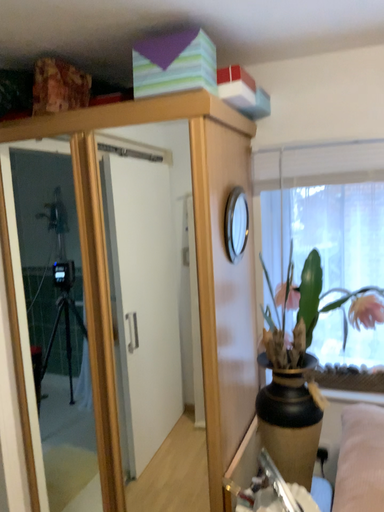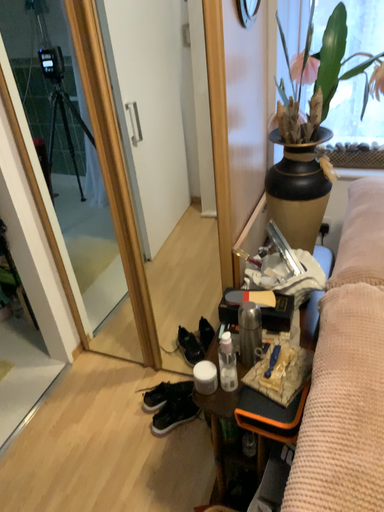
Question: Which way did the camera rotate in the video?

Choices:
 (A) rotated upward
 (B) rotated downward

Answer: (B)